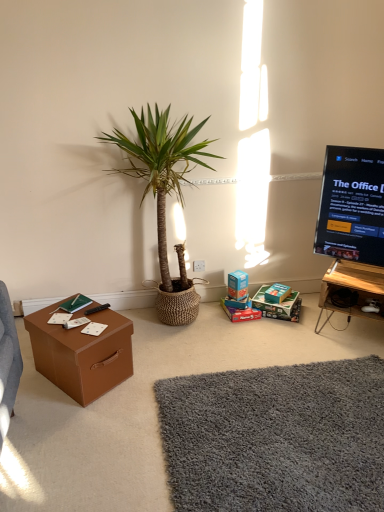
The image size is (384, 512). I want to click on blank area to the left of shaggy gray rug at lower center, placed as the 2th plain when sorted from front to back, so (109, 428).